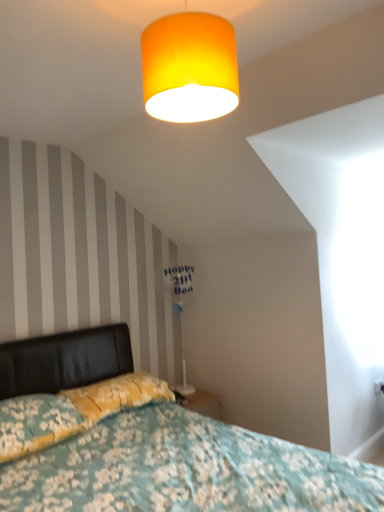
Question: Does yellow floral fabric pillow at lower left, which ranks as the 2th pillow in front-to-back order, have a lesser height compared to floral fabric pillow at lower left, which is the first pillow in front-to-back order?

Choices:
 (A) yes
 (B) no

Answer: (A)

Question: Can you confirm if yellow floral fabric pillow at lower left, which appears as the first pillow when viewed from the back, is wider than floral fabric pillow at lower left, which is the first pillow in front-to-back order?

Choices:
 (A) yes
 (B) no

Answer: (B)

Question: Would you say yellow floral fabric pillow at lower left, which ranks as the 2th pillow in front-to-back order, is outside floral fabric pillow at lower left, which is the first pillow in front-to-back order?

Choices:
 (A) yes
 (B) no

Answer: (A)

Question: Could floral fabric pillow at lower left, the 2th pillow when ordered from back to front, be considered to be inside yellow floral fabric pillow at lower left, which appears as the first pillow when viewed from the back?

Choices:
 (A) no
 (B) yes

Answer: (A)

Question: Is yellow floral fabric pillow at lower left, which ranks as the 2th pillow in front-to-back order, facing away from floral fabric pillow at lower left, which is the first pillow in front-to-back order?

Choices:
 (A) no
 (B) yes

Answer: (A)

Question: Considering the positions of white plastic table lamp at center and floral fabric pillow at lower left, the 2th pillow when ordered from back to front, in the image, is white plastic table lamp at center wider or thinner than floral fabric pillow at lower left, the 2th pillow when ordered from back to front,?

Choices:
 (A) wide
 (B) thin

Answer: (B)

Question: In terms of height, does white plastic table lamp at center look taller or shorter compared to floral fabric pillow at lower left, which is the first pillow in front-to-back order?

Choices:
 (A) short
 (B) tall

Answer: (B)

Question: Is point (190, 284) positioned closer to the camera than point (52, 416)?

Choices:
 (A) farther
 (B) closer

Answer: (A)

Question: In the image, is white plastic table lamp at center positioned in front of or behind floral fabric pillow at lower left, which is the first pillow in front-to-back order?

Choices:
 (A) front
 (B) behind

Answer: (B)

Question: From the image's perspective, relative to white plastic table lamp at center, is yellow floral fabric pillow at lower left, which appears as the first pillow when viewed from the back, above or below?

Choices:
 (A) above
 (B) below

Answer: (B)

Question: In terms of size, does yellow floral fabric pillow at lower left, which appears as the first pillow when viewed from the back, appear bigger or smaller than white plastic table lamp at center?

Choices:
 (A) big
 (B) small

Answer: (B)

Question: In the image, is yellow floral fabric pillow at lower left, which appears as the first pillow when viewed from the back, on the left side or the right side of white plastic table lamp at center?

Choices:
 (A) right
 (B) left

Answer: (B)

Question: From a real-world perspective, relative to white plastic table lamp at center, is yellow floral fabric pillow at lower left, which ranks as the 2th pillow in front-to-back order, vertically above or below?

Choices:
 (A) below
 (B) above

Answer: (A)

Question: From a real-world perspective, is orange fabric lampshade at upper center physically located above or below floral fabric bed at lower left?

Choices:
 (A) below
 (B) above

Answer: (B)

Question: From the image's perspective, is orange fabric lampshade at upper center positioned above or below floral fabric bed at lower left?

Choices:
 (A) above
 (B) below

Answer: (A)